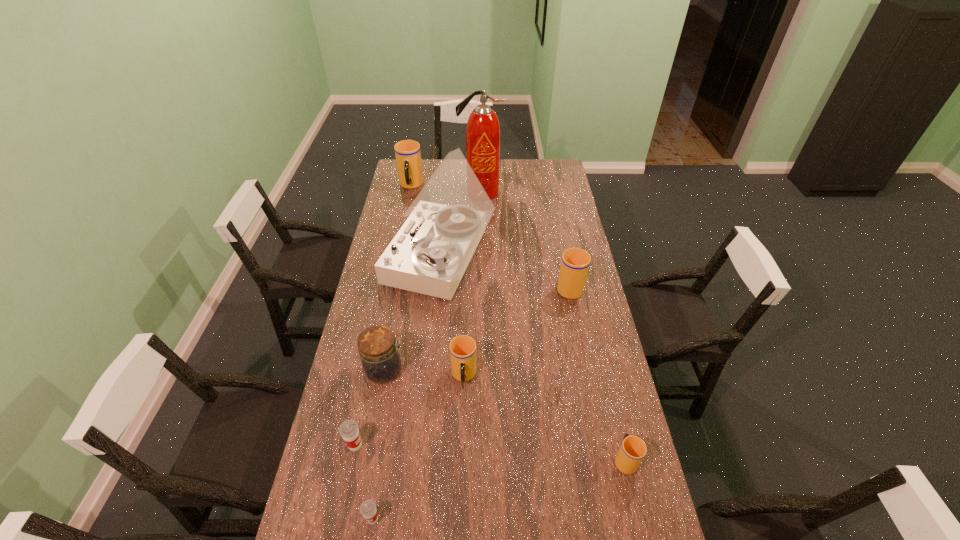
Find the location of `fire extinguisher`. fire extinguisher is located at coordinates (483, 130).

The height and width of the screenshot is (540, 960). I want to click on red fire extinguisher, so click(483, 130).

The width and height of the screenshot is (960, 540). I want to click on record player, so click(x=430, y=253).

Find the location of a particular element. The height and width of the screenshot is (540, 960). white record player is located at coordinates (430, 253).

Where is `the biggest beige cup`? This screenshot has width=960, height=540. the biggest beige cup is located at coordinates (407, 152).

The height and width of the screenshot is (540, 960). I want to click on the tallest cup, so click(407, 152).

Identify the location of the second tallest cup. (575, 262).

The width and height of the screenshot is (960, 540). What are the coordinates of `the second farthest cup` in the screenshot? It's located at (x=575, y=262).

Identify the location of jar. (380, 358).

Where is `the bigger red cup`? the bigger red cup is located at coordinates [349, 430].